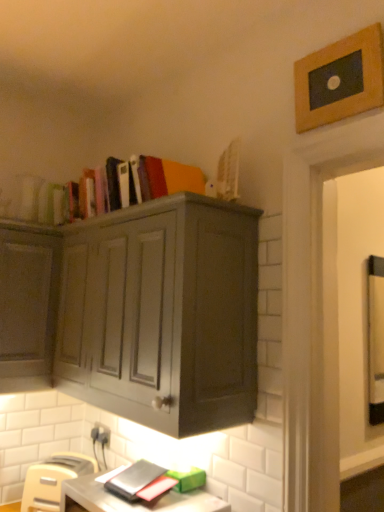
Question: Considering the positions of point (67, 470) and point (1, 331), is point (67, 470) closer or farther from the camera than point (1, 331)?

Choices:
 (A) closer
 (B) farther

Answer: (B)

Question: From the image's perspective, is beige plastic toaster at lower left positioned above or below matte gray cabinet at upper center?

Choices:
 (A) above
 (B) below

Answer: (B)

Question: Which object is positioned farthest from the white plastic electric outlet at lower left?

Choices:
 (A) wooden picture frame at upper right
 (B) matte hardcover books at upper center
 (C) beige plastic toaster at lower left
 (D) matte gray desk at lower center
 (E) matte gray cabinet at upper center

Answer: (A)

Question: Which is farther from the beige plastic toaster at lower left?

Choices:
 (A) matte gray desk at lower center
 (B) wooden picture frame at upper right
 (C) white plastic electric outlet at lower left
 (D) matte gray cabinet at upper center
 (E) matte hardcover books at upper center

Answer: (B)